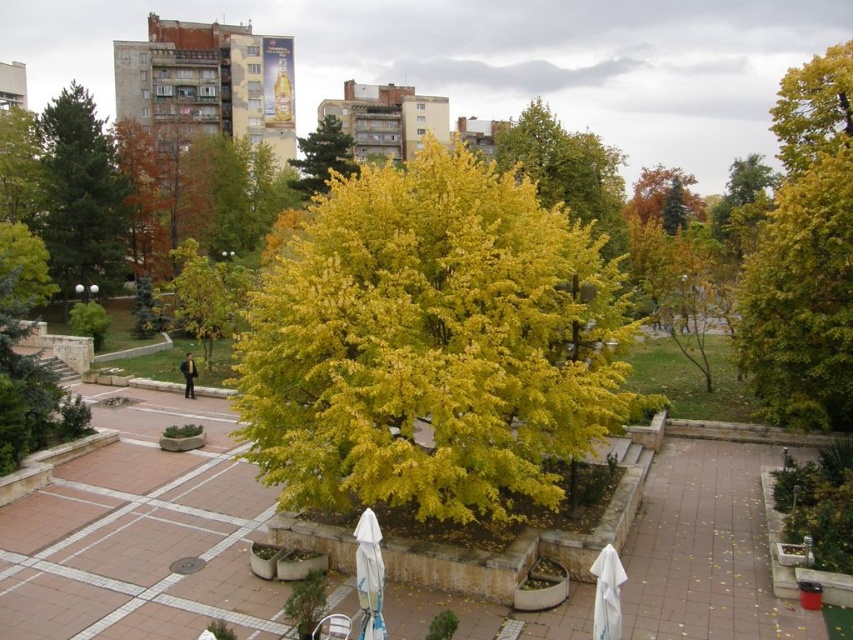
Is yellow-green foliage at center shorter than white fabric umbrella at lower center?

No, yellow-green foliage at center is not shorter than white fabric umbrella at lower center.

Who is taller, yellow-green foliage at center or white fabric umbrella at lower center?

Standing taller between the two is yellow-green foliage at center.

The width and height of the screenshot is (853, 640). Find the location of `yellow-green foliage at center`. yellow-green foliage at center is located at coordinates (322, 157).

Is point (225, 289) positioned in front of point (656, 204)?

Yes.

Is yellow-green leafy tree at center-left above orange matte tree at upper right?

No, yellow-green leafy tree at center-left is not above orange matte tree at upper right.

Where is `yellow-green leafy tree at center-left`? This screenshot has height=640, width=853. yellow-green leafy tree at center-left is located at coordinates (202, 296).

Who is higher up, green matte tree at left or yellow-green foliage at center?

yellow-green foliage at center is above.

Where is `green matte tree at left`? The image size is (853, 640). green matte tree at left is located at coordinates (80, 195).

Between point (55, 163) and point (328, 150), which one is positioned in front?

Point (55, 163)

You are a GUI agent. You are given a task and a screenshot of the screen. Output one action in this format:
    pyautogui.click(x=<x>, y=<y>)
    Task: Click on the green matte tree at left
    
    Given the screenshot: What is the action you would take?
    pyautogui.click(x=80, y=195)